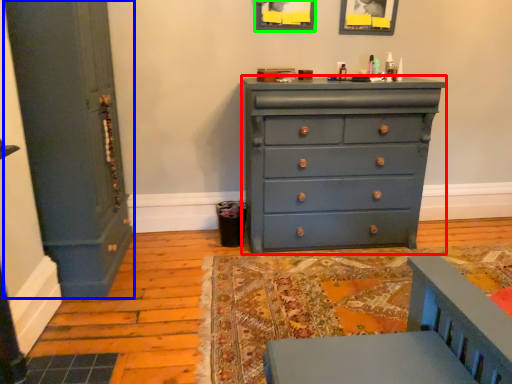
Question: Which object is the farthest from chest of drawers (highlighted by a red box)? Choose among these: door (highlighted by a blue box) or picture frame (highlighted by a green box).

Choices:
 (A) door
 (B) picture frame

Answer: (A)